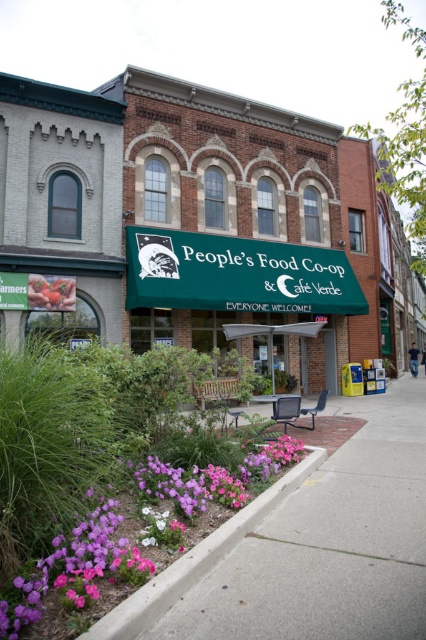
Question: Which point appears farthest from the camera in this image?

Choices:
 (A) (406, 580)
 (B) (267, 490)

Answer: (B)

Question: Is paved concrete sidewalk at lower center closer to camera compared to concrete at lower center?

Choices:
 (A) yes
 (B) no

Answer: (B)

Question: Is paved concrete sidewalk at lower center wider than concrete at lower center?

Choices:
 (A) yes
 (B) no

Answer: (A)

Question: From the image, what is the correct spatial relationship of paved concrete sidewalk at lower center in relation to concrete at lower center?

Choices:
 (A) right
 (B) left

Answer: (A)

Question: Which of the following is the closest to the observer?

Choices:
 (A) (187, 580)
 (B) (288, 625)

Answer: (B)